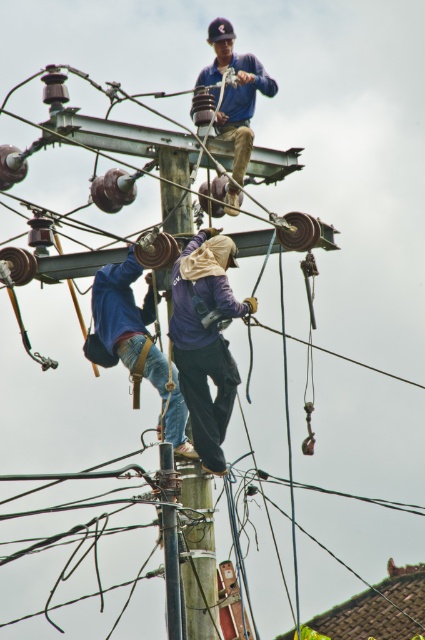
Question: Among these objects, which one is farthest from the camera?

Choices:
 (A) wooden telegraph pole at center
 (B) blue denim jeans at center
 (C) purple fabric construction worker at center

Answer: (C)

Question: Does purple fabric construction worker at center come in front of blue denim jeans at center?

Choices:
 (A) yes
 (B) no

Answer: (B)

Question: Which of these objects is positioned closest to the blue denim jeans at center?

Choices:
 (A) blue denim shirt at upper center
 (B) wooden telegraph pole at center
 (C) purple fabric construction worker at center

Answer: (C)

Question: Considering the real-world distances, which object is closest to the wooden telegraph pole at center?

Choices:
 (A) blue denim jeans at center
 (B) blue denim shirt at upper center
 (C) purple fabric construction worker at center

Answer: (C)

Question: Is blue denim shirt at upper center to the left of wooden telegraph pole at center from the viewer's perspective?

Choices:
 (A) yes
 (B) no

Answer: (B)

Question: Is purple fabric construction worker at center in front of blue denim shirt at upper center?

Choices:
 (A) no
 (B) yes

Answer: (B)